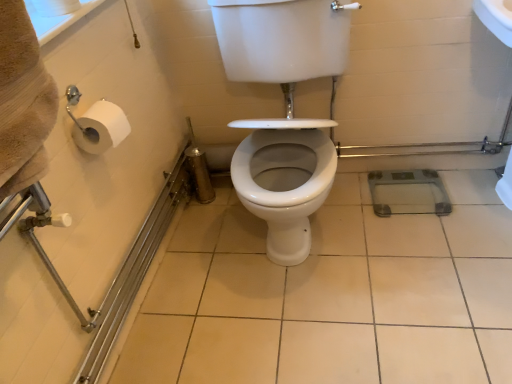
I want to click on free space in front of white glossy toilet seat at center, so click(330, 331).